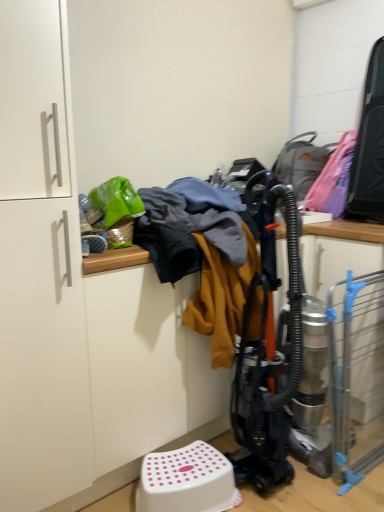
Question: Would you say white plastic step stool at lower center is inside or outside green plastic bag at upper left?

Choices:
 (A) inside
 (B) outside

Answer: (B)

Question: Visually, is white plastic step stool at lower center positioned to the left or to the right of green plastic bag at upper left?

Choices:
 (A) left
 (B) right

Answer: (B)

Question: Estimate the real-world distances between objects in this image. Which object is closer to the white matte cabinet at left?

Choices:
 (A) green plastic bag at upper left
 (B) green plastic basket at upper left
 (C) white plastic step stool at lower center

Answer: (A)

Question: Considering the real-world distances, which object is farthest from the white plastic step stool at lower center?

Choices:
 (A) green plastic bag at upper left
 (B) white matte cabinet at left
 (C) green plastic basket at upper left

Answer: (A)